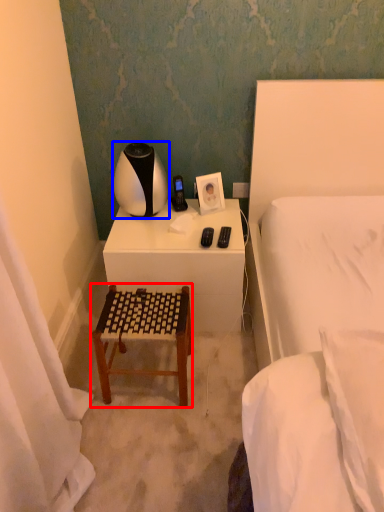
Question: Which of the following is the closest to the observer, furniture (highlighted by a red box) or table lamp (highlighted by a blue box)?

Choices:
 (A) furniture
 (B) table lamp

Answer: (A)